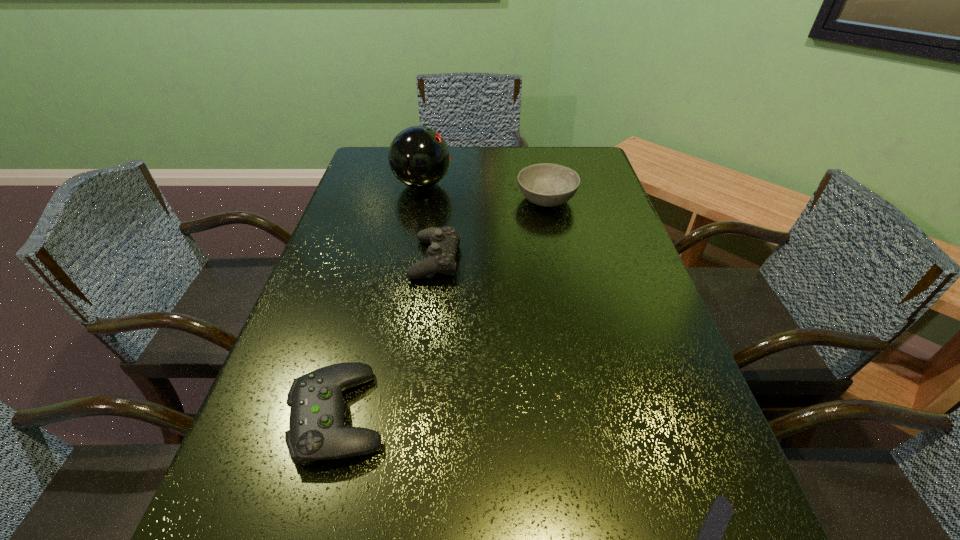
Identify the location of bowling ball. The height and width of the screenshot is (540, 960). (419, 157).

What are the coordinates of `bowl` in the screenshot? It's located at (545, 184).

Locate an element on the screen. This screenshot has height=540, width=960. the third farthest object is located at coordinates (444, 241).

At what (x,y) coordinates should I click in order to perform the action: click on the taller control. Please return your answer as a coordinate pair (x, y). Image resolution: width=960 pixels, height=540 pixels. Looking at the image, I should click on (444, 241).

The width and height of the screenshot is (960, 540). In order to click on the nearer control in this screenshot , I will do `click(316, 432)`.

What are the coordinates of `the fourth tallest object` in the screenshot? It's located at (316, 432).

Where is `vacant space located on the surface of the tallest object near the finger holes`? The image size is (960, 540). vacant space located on the surface of the tallest object near the finger holes is located at coordinates (481, 185).

Where is `vacant region located on the left of the bowl`? Image resolution: width=960 pixels, height=540 pixels. vacant region located on the left of the bowl is located at coordinates (489, 199).

Locate an element on the screen. Image resolution: width=960 pixels, height=540 pixels. vacant space located on the right of the third farthest object is located at coordinates (624, 259).

Find the location of a particular element. The height and width of the screenshot is (540, 960). vacant area situated on the front of the nearer control is located at coordinates (308, 532).